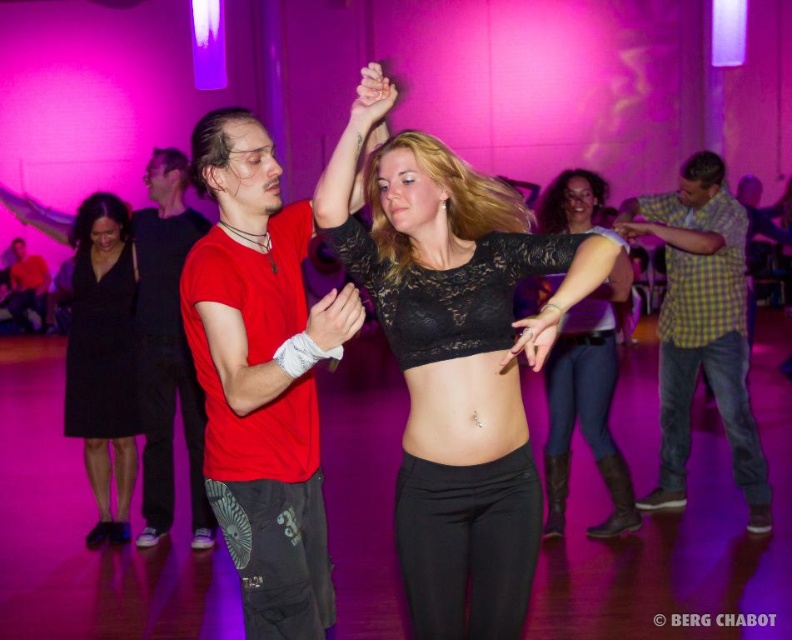
You are at the dance floor and see two points marked on the floor. The first point is at coordinate point(448, 429) and the second at point(674, 339). If you are facing the dance floor, which point is closer to you?

Point(448, 429) is in front of point(674, 339), so it is closer to you.